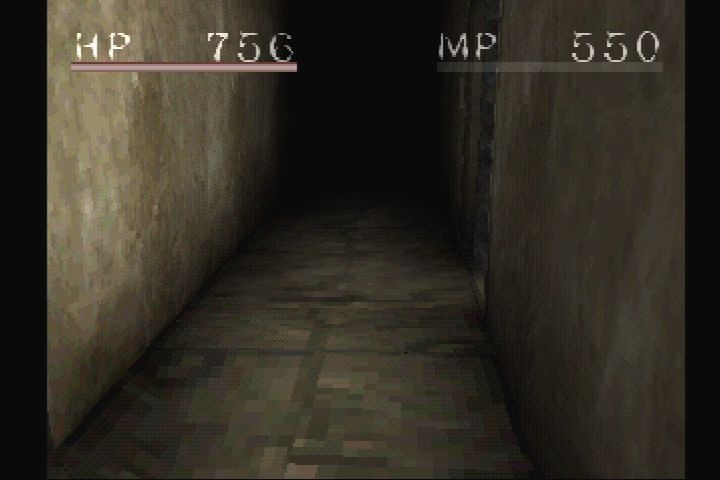
I want to click on doorway, so click(x=482, y=224).